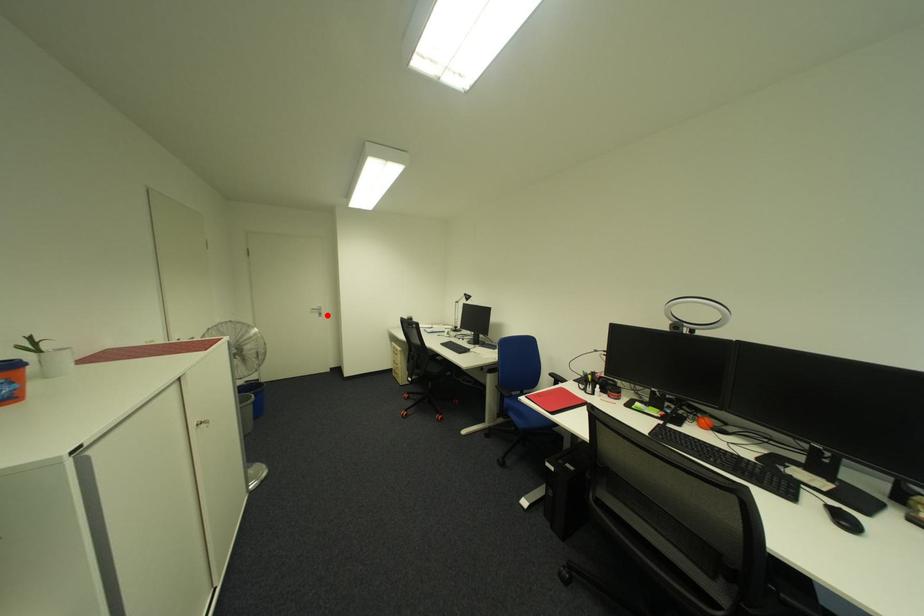
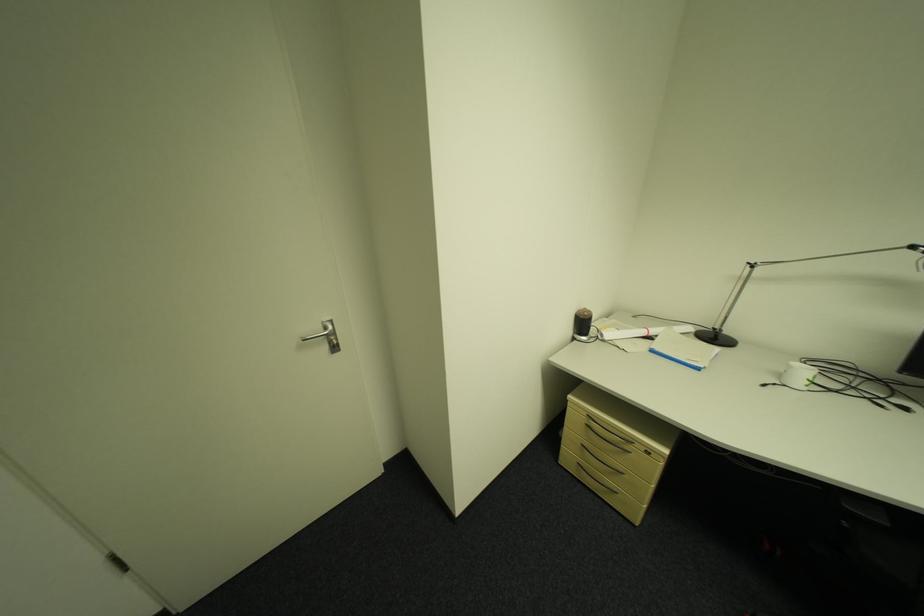
In the second image, find the point that corresponds to the highlighted location in the first image.

(335, 349)